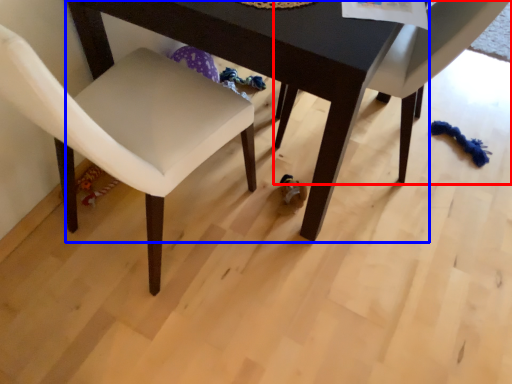
Question: Which object appears closest to the camera in this image, chair (highlighted by a red box) or table (highlighted by a blue box)?

Choices:
 (A) chair
 (B) table

Answer: (B)